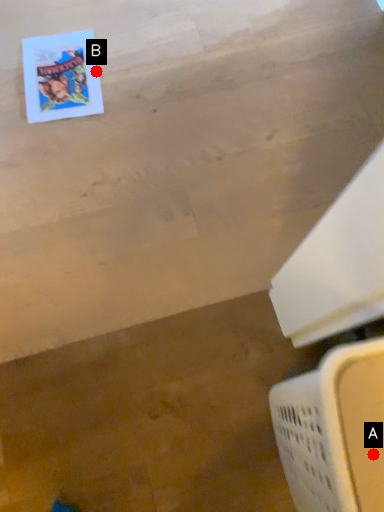
Question: Two points are circled on the image, labeled by A and B beside each circle. Which of the following is the farthest from the observer?

Choices:
 (A) A is further
 (B) B is further

Answer: (B)